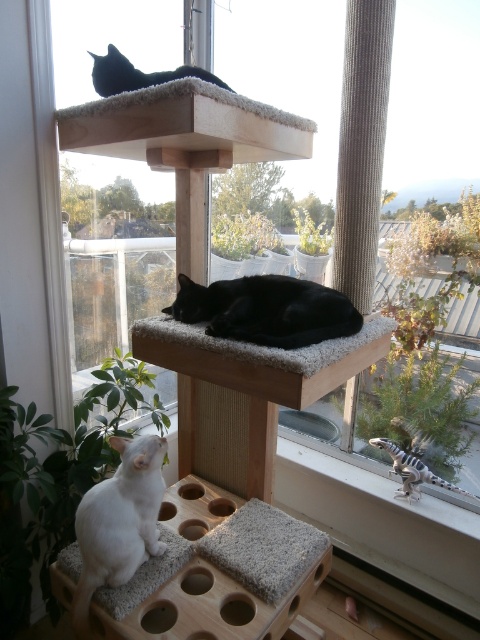
Question: Is black fur cat at center positioned in front of black fur cat at upper center?

Choices:
 (A) yes
 (B) no

Answer: (A)

Question: Can you confirm if white fluffy cat at lower left is smaller than black fur cat at center?

Choices:
 (A) no
 (B) yes

Answer: (B)

Question: Among these objects, which one is farthest from the camera?

Choices:
 (A) white fluffy cat at lower left
 (B) black fur cat at upper center
 (C) black fur cat at center

Answer: (B)

Question: Which point is farther to the camera?

Choices:
 (A) black fur cat at upper center
 (B) black fur cat at center
 (C) white fluffy cat at lower left

Answer: (A)

Question: Which object is positioned farthest from the black fur cat at center?

Choices:
 (A) white fluffy cat at lower left
 (B) black fur cat at upper center

Answer: (B)

Question: Does white fluffy cat at lower left have a lesser width compared to black fur cat at center?

Choices:
 (A) no
 (B) yes

Answer: (B)